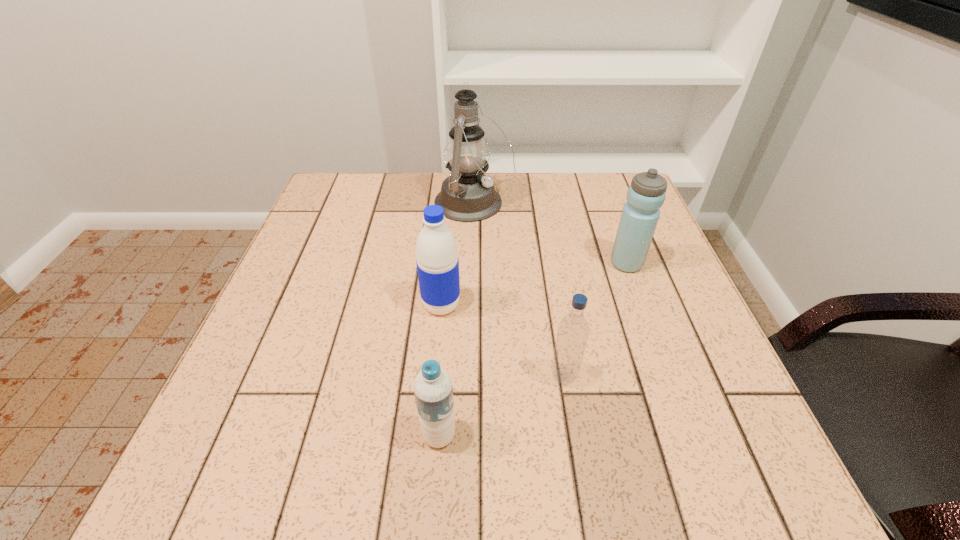
Where is `free space at the far right corner of the desktop`? The height and width of the screenshot is (540, 960). free space at the far right corner of the desktop is located at coordinates coord(609,216).

Identify the location of free spot between the fourth farthest object and the nearest object. (x=501, y=406).

You are a GUI agent. You are given a task and a screenshot of the screen. Output one action in this format:
    pyautogui.click(x=<x>, y=<y>)
    Task: Click on the vacant point located between the nearest water bottle and the rightmost object
    The width and height of the screenshot is (960, 540).
    Given the screenshot: What is the action you would take?
    pyautogui.click(x=533, y=349)

Find the location of a particular element. This screenshot has width=960, height=540. free space between the third nearest water bottle and the rightmost object is located at coordinates (534, 284).

Find the location of `free area in between the farthest water bottle and the third farthest object`. free area in between the farthest water bottle and the third farthest object is located at coordinates (534, 284).

The image size is (960, 540). I want to click on blank region between the third nearest water bottle and the third water bottle from left to right, so click(x=502, y=341).

Find the location of `vacant space in between the oil lamp and the nearest water bottle`. vacant space in between the oil lamp and the nearest water bottle is located at coordinates (457, 320).

Identify the location of free spot between the second farthest water bottle and the second nearest object. (502, 341).

Where is `free area in between the third farthest object and the rightmost water bottle`? This screenshot has height=540, width=960. free area in between the third farthest object and the rightmost water bottle is located at coordinates (534, 284).

You are a GUI agent. You are given a task and a screenshot of the screen. Output one action in this format:
    pyautogui.click(x=<x>, y=<y>)
    Task: Click on the vacant area between the oil lamp and the nearest water bottle
    The height and width of the screenshot is (540, 960).
    Given the screenshot: What is the action you would take?
    pyautogui.click(x=457, y=320)